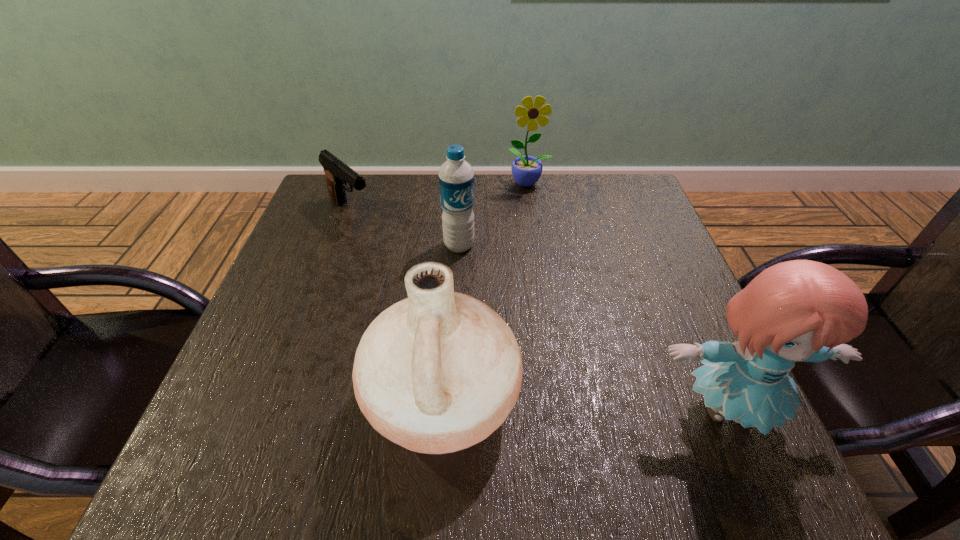
Where is `free location located 0.080m on the label of the third farthest object`? This screenshot has width=960, height=540. free location located 0.080m on the label of the third farthest object is located at coordinates (483, 275).

I want to click on vacant space located 0.070m on the label of the third farthest object, so tap(481, 272).

The image size is (960, 540). I want to click on vacant area situated 0.360m on the label of the third farthest object, so click(558, 368).

Where is `blank space located at the barrel of the shortest object`? Image resolution: width=960 pixels, height=540 pixels. blank space located at the barrel of the shortest object is located at coordinates (459, 307).

Identify the location of free location located at the barrel of the shortest object. (450, 299).

I want to click on vacant region located 0.190m at the barrel of the shortest object, so click(x=409, y=263).

Image resolution: width=960 pixels, height=540 pixels. In order to click on vacant space positioned 0.150m on the front-facing side of the fourth object from left to right in this screenshot , I will do coord(535,225).

Where is `vacant space located on the front-facing side of the fourth object from left to right`? Image resolution: width=960 pixels, height=540 pixels. vacant space located on the front-facing side of the fourth object from left to right is located at coordinates (535, 227).

In order to click on free spot located 0.110m on the front-facing side of the fourth object from left to right in this screenshot , I will do pos(534,215).

Identify the location of pistol that is at the far edge. (337, 173).